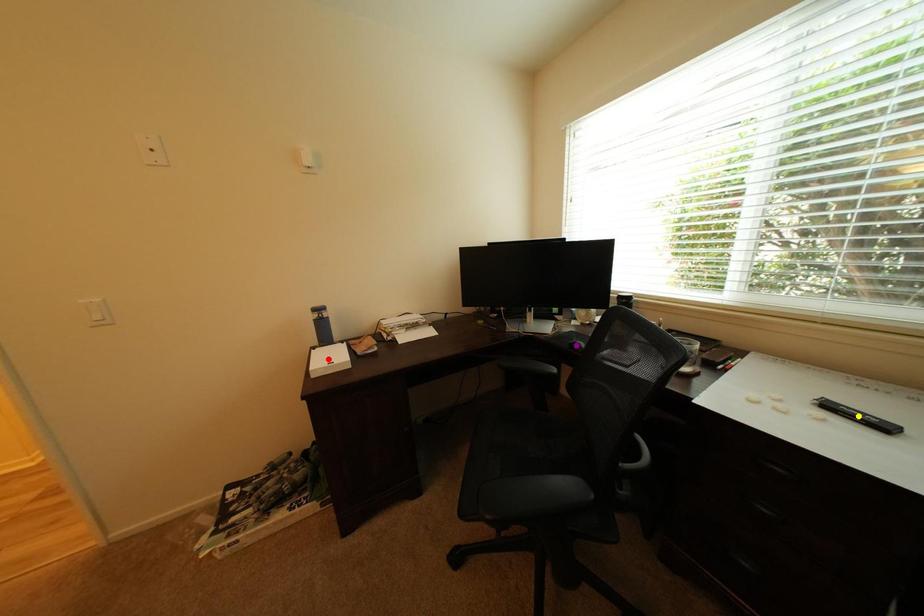
Order these from nearest to farthest:
- purple point
- yellow point
- red point

yellow point
red point
purple point